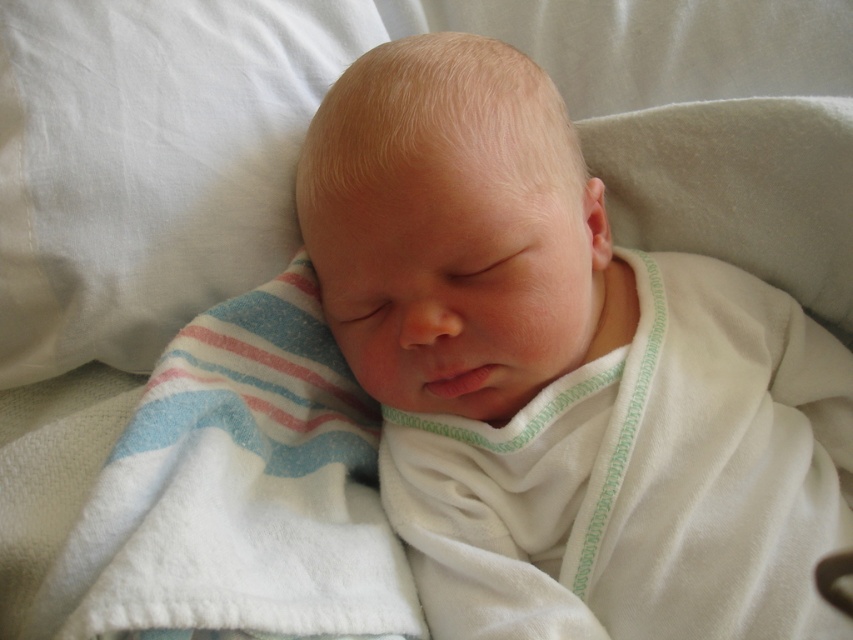
You are holding a toy that is 30 inches long. You want to place it near the point marked at coordinates point (433,412). Can you reach that point with the toy without stretching too far?

The point marked at coordinates point (433,412) is 29.56 inches from the viewer, so yes, the toy can be placed there as it is within reach.

You are a nurse checking on a newborn. You notice the smooth white baby at center and the white soft blanket at center. Which object is closer to you?

The smooth white baby at center is closer to you since it is positioned over the white soft blanket at center.

You are a nurse preparing to change the baby. You need to place the white cotton pillow at upper left and the white soft blanket at center on a shelf. If the shelf has limited space, which item should you place first to ensure both fit?

The white cotton pillow at upper left is smaller than the white soft blanket at center, so you should place the white cotton pillow at upper left first to ensure both items fit on the shelf.